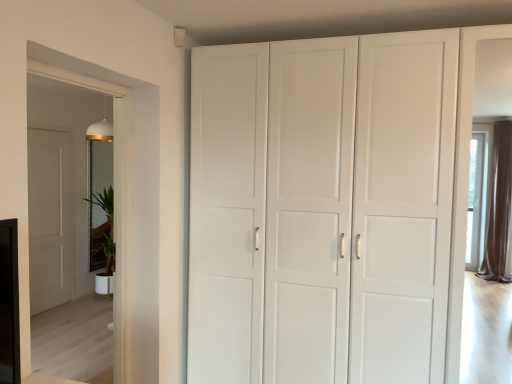
Identify the location of white glossy plant at left. This screenshot has width=512, height=384. (109, 224).

The width and height of the screenshot is (512, 384). What do you see at coordinates (109, 224) in the screenshot? I see `white glossy plant at left` at bounding box center [109, 224].

Measure the distance between white matte cabinet at center and camera.

A distance of 2.10 meters exists between white matte cabinet at center and camera.

What are the coordinates of `transparent glass door at left` in the screenshot? It's located at (113, 112).

Is point (111, 206) closer or farther from the camera than point (351, 109)?

Clearly, point (111, 206) is more distant from the camera than point (351, 109).

Is white glossy plant at left taller than white matte cabinet at center?

No.

From the image's perspective, which one is positioned higher, white glossy plant at left or white matte cabinet at center?

white matte cabinet at center appears higher in the image.

In the scene shown: From the image's perspective, which is below, white matte cabinet at center or transparent glass door at left?

white matte cabinet at center is shown below in the image.

From the picture: Is white matte cabinet at center in contact with transparent glass door at left?

No, white matte cabinet at center is not touching transparent glass door at left.

From a real-world perspective, is white matte cabinet at center on transparent glass door at left?

Incorrect, from a real-world perspective, white matte cabinet at center is lower than transparent glass door at left.

Is white matte cabinet at center behind white glossy plant at left?

No.

Choose the correct answer: Is white matte cabinet at center inside white glossy plant at left or outside it?

white matte cabinet at center is outside white glossy plant at left.

Looking at this image, considering the sizes of white matte cabinet at center and white glossy plant at left in the image, is white matte cabinet at center wider or thinner than white glossy plant at left?

Considering their sizes, white matte cabinet at center looks broader than white glossy plant at left.

Which point is more forward, [374,369] or [106,199]?

The point [374,369] is closer to the camera.

Which object is positioned more to the left, transparent glass door at left or white glossy plant at left?

From the viewer's perspective, white glossy plant at left appears more on the left side.

Is transparent glass door at left shorter than white glossy plant at left?

No, transparent glass door at left is not shorter than white glossy plant at left.

Is transparent glass door at left further to the viewer compared to white glossy plant at left?

No, it is in front of white glossy plant at left.

From a real-world perspective, which is physically below, transparent glass door at left or white glossy plant at left?

white glossy plant at left is physically lower.

Which object is wider, transparent glass door at left or white matte cabinet at center?

white matte cabinet at center is wider.

Does point (76, 79) come closer to viewer compared to point (364, 93)?

Yes, it is in front of point (364, 93).

Considering the relative positions of transparent glass door at left and white matte cabinet at center in the image provided, is transparent glass door at left to the right of white matte cabinet at center from the viewer's perspective?

No, transparent glass door at left is not to the right of white matte cabinet at center.

Between white glossy plant at left and transparent glass door at left, which one is positioned behind?

white glossy plant at left.

The width and height of the screenshot is (512, 384). I want to click on plant lying on the left of transparent glass door at left, so click(x=109, y=224).

Is white glossy plant at left positioned with its back to transparent glass door at left?

That's not correct — white glossy plant at left is not looking away from transparent glass door at left.

Between point (100, 249) and point (125, 89), which one is positioned in front?

Point (125, 89)

Where is `cupboard above the white glossy plant at left (from a real-world perspective)`? cupboard above the white glossy plant at left (from a real-world perspective) is located at coordinates (330, 207).

The height and width of the screenshot is (384, 512). Identify the location of cupboard below the transparent glass door at left (from a real-world perspective). (330, 207).

Considering their positions, is transparent glass door at left positioned closer to white matte cabinet at center than white glossy plant at left?

Based on the image, transparent glass door at left appears to be nearer to white matte cabinet at center.

Considering their positions, is transparent glass door at left positioned further to white glossy plant at left than white matte cabinet at center?

white matte cabinet at center is positioned further to the anchor white glossy plant at left.

Considering their positions, is white matte cabinet at center positioned closer to transparent glass door at left than white glossy plant at left?

Based on the image, white matte cabinet at center appears to be nearer to transparent glass door at left.

Considering their positions, is white glossy plant at left positioned further to white matte cabinet at center than transparent glass door at left?

white glossy plant at left is positioned further to the anchor white matte cabinet at center.

Based on their spatial positions, is white glossy plant at left or white matte cabinet at center closer to transparent glass door at left?

white matte cabinet at center is closer to transparent glass door at left.

Which object lies further to the anchor point white glossy plant at left, white matte cabinet at center or transparent glass door at left?

The object further to white glossy plant at left is white matte cabinet at center.

Find the location of a particular element. The height and width of the screenshot is (384, 512). cupboard between transparent glass door at left and white glossy plant at left in the front-back direction is located at coordinates (330, 207).